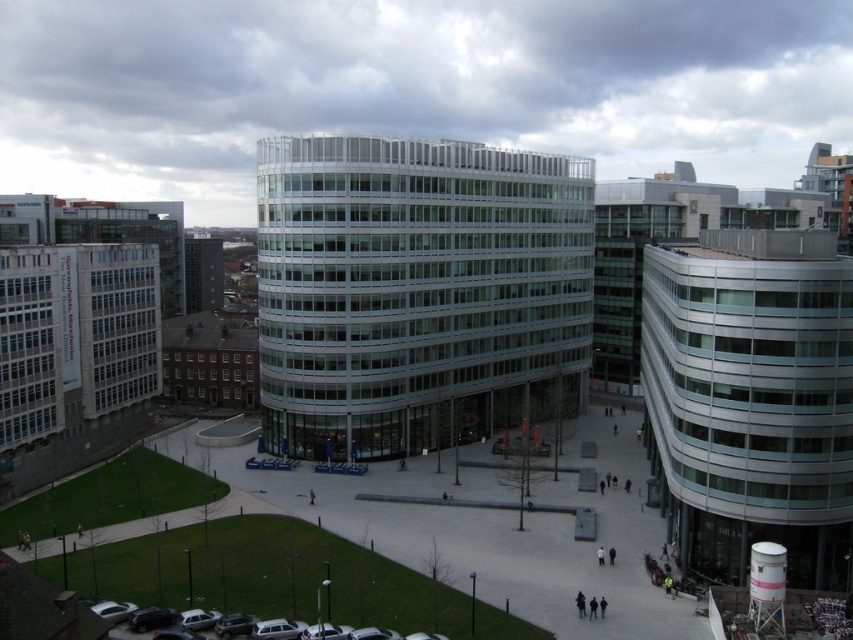
You are a pedestrian standing at the entrance of the plaza. You see the glassy metallic building at center and the matte black car at lower left. Which object is located to the right of the other?

The glassy metallic building at center is positioned on the right side of matte black car at lower left.

You are standing in the plaza in front of the glassy metallic building at center. You want to take a photo of the entire building without any obstructions. Considering the distance, is it possible to capture the whole building in one frame from your current position?

The glassy metallic building at center is 89.36 meters away from the camera. Depending on the camera lens and zoom capabilities, capturing the entire building in one frame may be possible. However, standard smartphone cameras might require moving closer or using a wide angle lens to ensure the entire structure fits within the frame.